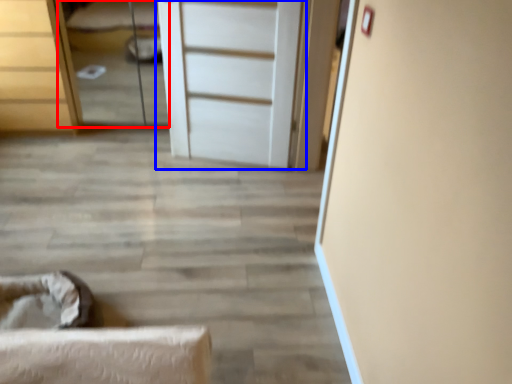
Question: Among these objects, which one is farthest to the camera, bed (highlighted by a red box) or door (highlighted by a blue box)?

Choices:
 (A) bed
 (B) door

Answer: (A)